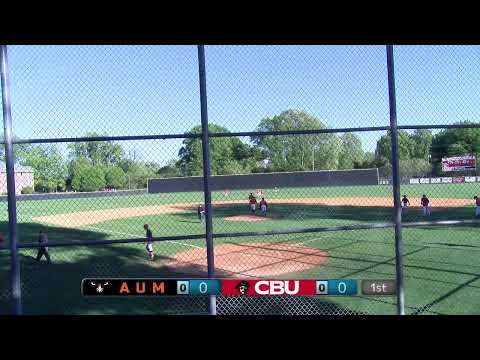
The width and height of the screenshot is (480, 360). I want to click on lower wall on left in the background, so click(68, 197).